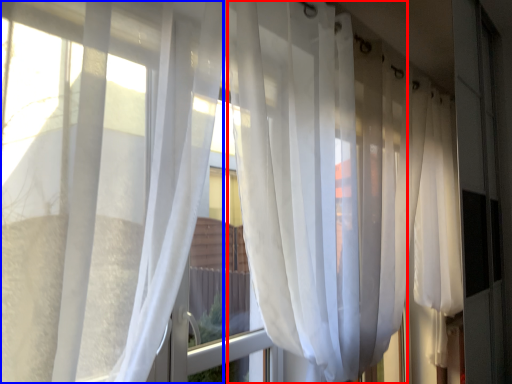
Question: Among these objects, which one is farthest to the camera, curtain (highlighted by a red box) or curtain (highlighted by a blue box)?

Choices:
 (A) curtain
 (B) curtain

Answer: (A)